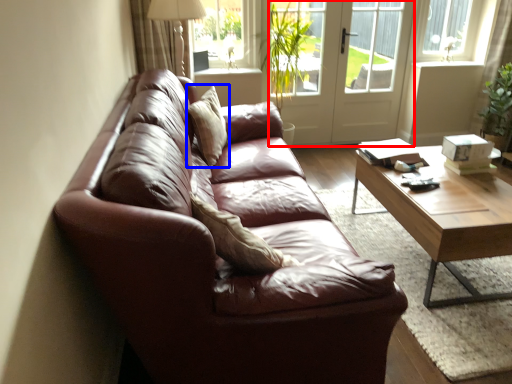
Question: Among these objects, which one is farthest to the camera, screen door (highlighted by a red box) or pillow (highlighted by a blue box)?

Choices:
 (A) screen door
 (B) pillow

Answer: (A)